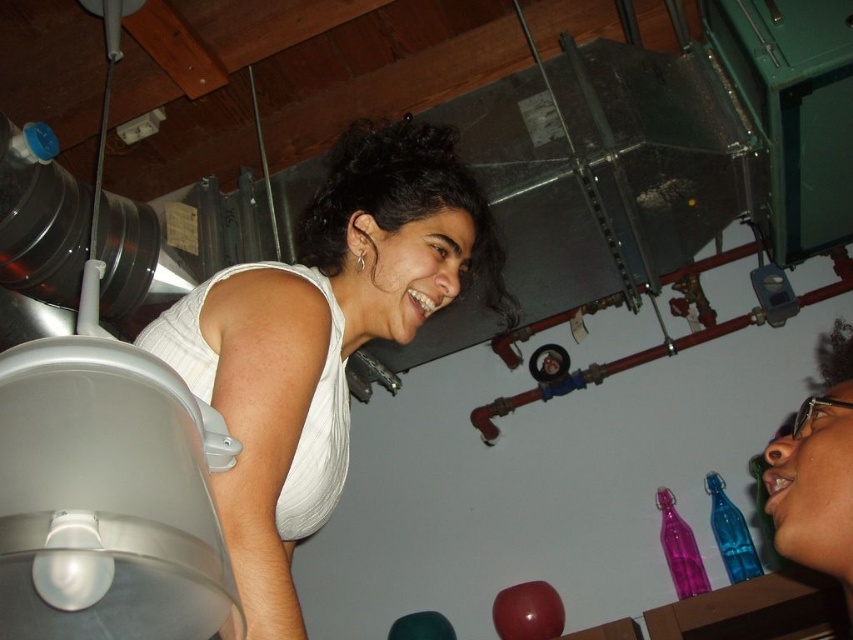
Question: Is matte black glasses at lower right positioned at the back of translucent blue glass bottle at lower right?

Choices:
 (A) yes
 (B) no

Answer: (B)

Question: Considering the real-world distances, which object is farthest from the translucent blue glass bottle at lower right?

Choices:
 (A) matte black glasses at lower right
 (B) white matte tank top at upper left

Answer: (B)

Question: Does white matte tank top at upper left appear under matte black glasses at lower right?

Choices:
 (A) no
 (B) yes

Answer: (A)

Question: Which of these objects is positioned farthest from the white matte tank top at upper left?

Choices:
 (A) translucent purple glass bottle at lower right
 (B) matte black glasses at lower right

Answer: (A)

Question: Which of the following is the closest to the observer?

Choices:
 (A) (828, 360)
 (B) (747, 544)
 (C) (693, 557)

Answer: (A)

Question: Can you confirm if white matte tank top at upper left is smaller than translucent blue glass bottle at lower right?

Choices:
 (A) yes
 (B) no

Answer: (B)